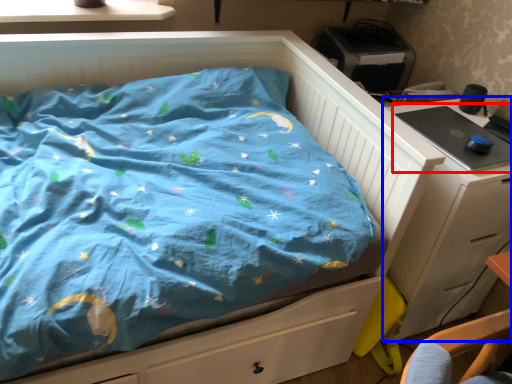
Question: Which point is further to the camera, desktop (highlighted by a red box) or chest of drawers (highlighted by a blue box)?

Choices:
 (A) desktop
 (B) chest of drawers

Answer: (A)